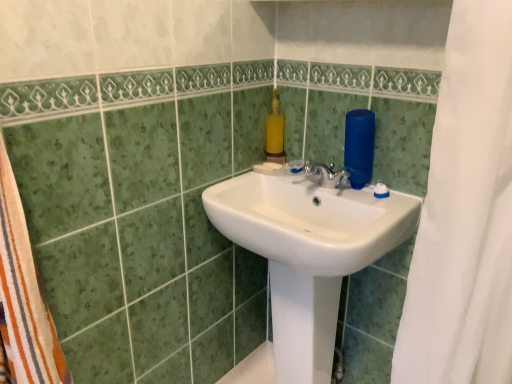
Question: Should I look upward or downward to see yellow matte soap dispenser at upper center?

Choices:
 (A) down
 (B) up

Answer: (B)

Question: From the image's perspective, would you say white glossy sink at center is positioned over yellow matte soap dispenser at upper center?

Choices:
 (A) yes
 (B) no

Answer: (B)

Question: From a real-world perspective, is white glossy sink at center positioned under yellow matte soap dispenser at upper center based on gravity?

Choices:
 (A) yes
 (B) no

Answer: (A)

Question: Considering the relative sizes of white glossy sink at center and yellow matte soap dispenser at upper center in the image provided, is white glossy sink at center shorter than yellow matte soap dispenser at upper center?

Choices:
 (A) yes
 (B) no

Answer: (B)

Question: Considering the relative sizes of white glossy sink at center and yellow matte soap dispenser at upper center in the image provided, is white glossy sink at center bigger than yellow matte soap dispenser at upper center?

Choices:
 (A) yes
 (B) no

Answer: (A)

Question: Is white glossy sink at center smaller than yellow matte soap dispenser at upper center?

Choices:
 (A) yes
 (B) no

Answer: (B)

Question: Can you confirm if white glossy sink at center is positioned to the left of yellow matte soap dispenser at upper center?

Choices:
 (A) yes
 (B) no

Answer: (B)

Question: Is yellow matte soap dispenser at upper center outside of white glossy sink at center?

Choices:
 (A) no
 (B) yes

Answer: (B)

Question: From a real-world perspective, is yellow matte soap dispenser at upper center over white glossy sink at center?

Choices:
 (A) no
 (B) yes

Answer: (B)

Question: Does yellow matte soap dispenser at upper center turn towards white glossy sink at center?

Choices:
 (A) yes
 (B) no

Answer: (B)

Question: Does yellow matte soap dispenser at upper center appear on the right side of white glossy sink at center?

Choices:
 (A) yes
 (B) no

Answer: (B)

Question: Considering the relative sizes of yellow matte soap dispenser at upper center and white glossy sink at center in the image provided, is yellow matte soap dispenser at upper center thinner than white glossy sink at center?

Choices:
 (A) yes
 (B) no

Answer: (A)

Question: Is yellow matte soap dispenser at upper center oriented away from white glossy sink at center?

Choices:
 (A) no
 (B) yes

Answer: (A)

Question: Do you think yellow matte soap dispenser at upper center is within white glossy sink at center, or outside of it?

Choices:
 (A) inside
 (B) outside

Answer: (B)